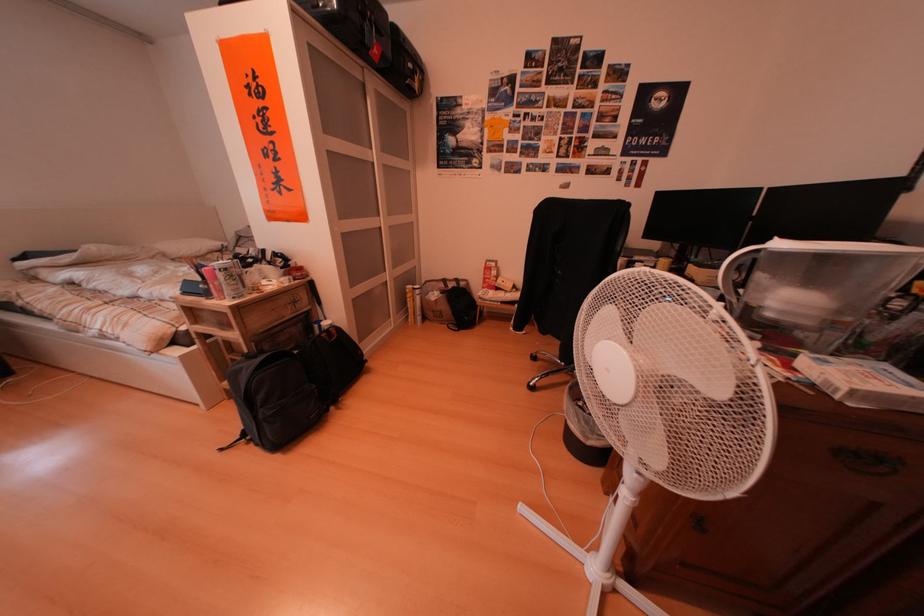
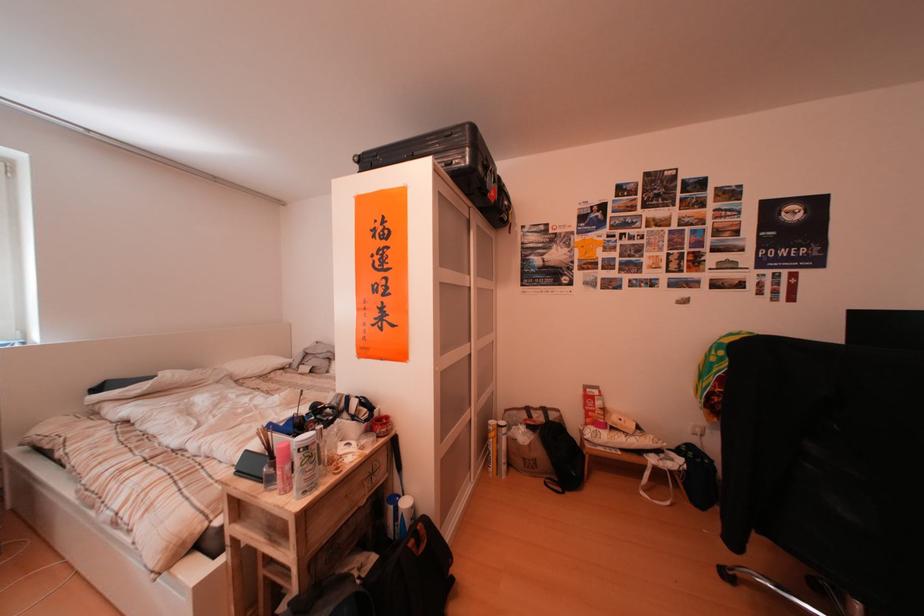
In the second image, find the point that corresponds to pixel 220 299 in the first image.

(282, 485)